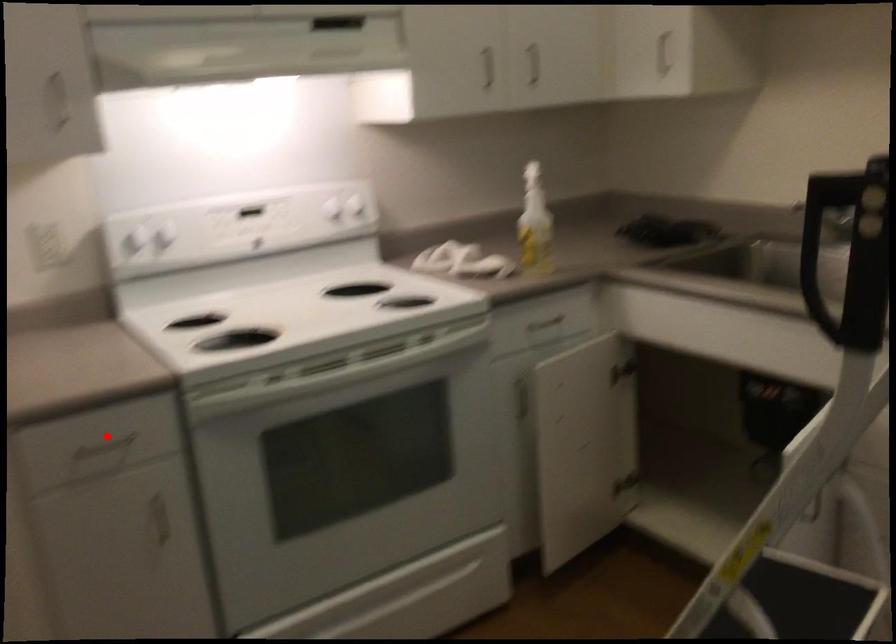
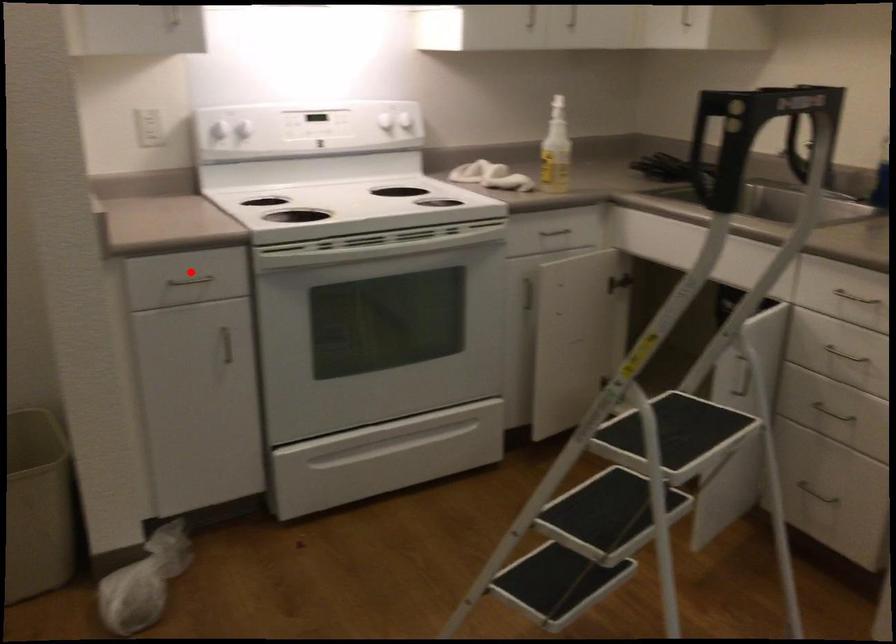
I am providing you with two images of the same scene from different viewpoints. A red point is marked on the first image and another point is marked on the second image. Does the point marked in image1 correspond to the same location as the one in image2?

Yes